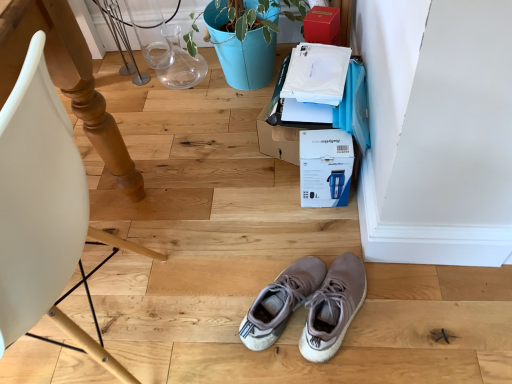
Question: From a real-world perspective, does matte wood chair at left stand above matte cardboard box at upper right, the first cardboard box positioned from the top?

Choices:
 (A) no
 (B) yes

Answer: (B)

Question: Does matte wood chair at left have a smaller size compared to matte cardboard box at upper right, which appears as the 2th cardboard box when ordered from the bottom?

Choices:
 (A) no
 (B) yes

Answer: (A)

Question: Is matte wood chair at left turned away from matte cardboard box at upper right, the first cardboard box positioned from the top?

Choices:
 (A) yes
 (B) no

Answer: (B)

Question: Is matte wood chair at left further to the viewer compared to matte cardboard box at upper right, which appears as the 2th cardboard box when ordered from the bottom?

Choices:
 (A) yes
 (B) no

Answer: (B)

Question: Does matte wood chair at left have a greater width compared to matte cardboard box at upper right, the first cardboard box positioned from the top?

Choices:
 (A) yes
 (B) no

Answer: (A)

Question: Is matte cardboard box at upper right, the first cardboard box positioned from the top, bigger or smaller than light gray suede sneakers at center?

Choices:
 (A) big
 (B) small

Answer: (B)

Question: Does point (306, 21) appear closer or farther from the camera than point (315, 297)?

Choices:
 (A) closer
 (B) farther

Answer: (B)

Question: Based on their positions, is matte cardboard box at upper right, which appears as the 2th cardboard box when ordered from the bottom, located to the left or right of light gray suede sneakers at center?

Choices:
 (A) right
 (B) left

Answer: (A)

Question: From a real-world perspective, is matte cardboard box at upper right, the first cardboard box positioned from the top, above or below light gray suede sneakers at center?

Choices:
 (A) above
 (B) below

Answer: (A)

Question: In the image, is matte cardboard box at upper right, the first cardboard box positioned from the top, positioned in front of or behind blue cardboard box at center, which is counted as the 1th cardboard box, starting from the bottom?

Choices:
 (A) front
 (B) behind

Answer: (B)

Question: Does point (320, 6) appear closer or farther from the camera than point (336, 205)?

Choices:
 (A) closer
 (B) farther

Answer: (B)

Question: From the image's perspective, is matte cardboard box at upper right, which appears as the 2th cardboard box when ordered from the bottom, positioned above or below blue cardboard box at center, which is the second cardboard box in top-to-bottom order?

Choices:
 (A) above
 (B) below

Answer: (A)

Question: Is matte cardboard box at upper right, the first cardboard box positioned from the top, situated inside blue cardboard box at center, which is the second cardboard box in top-to-bottom order, or outside?

Choices:
 (A) inside
 (B) outside

Answer: (B)

Question: In terms of height, does matte wood chair at left look taller or shorter compared to light gray suede sneakers at center?

Choices:
 (A) tall
 (B) short

Answer: (A)

Question: In terms of width, does matte wood chair at left look wider or thinner when compared to light gray suede sneakers at center?

Choices:
 (A) thin
 (B) wide

Answer: (B)